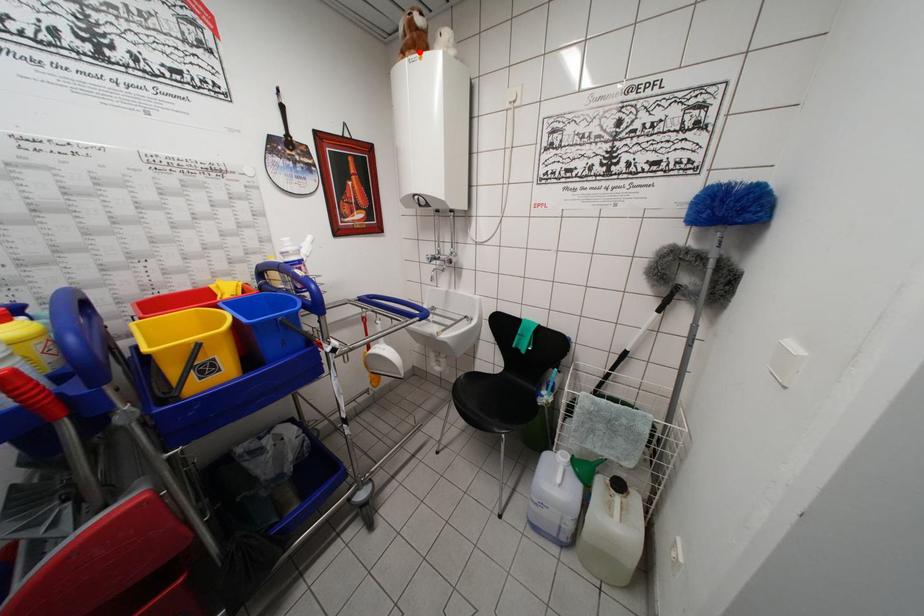
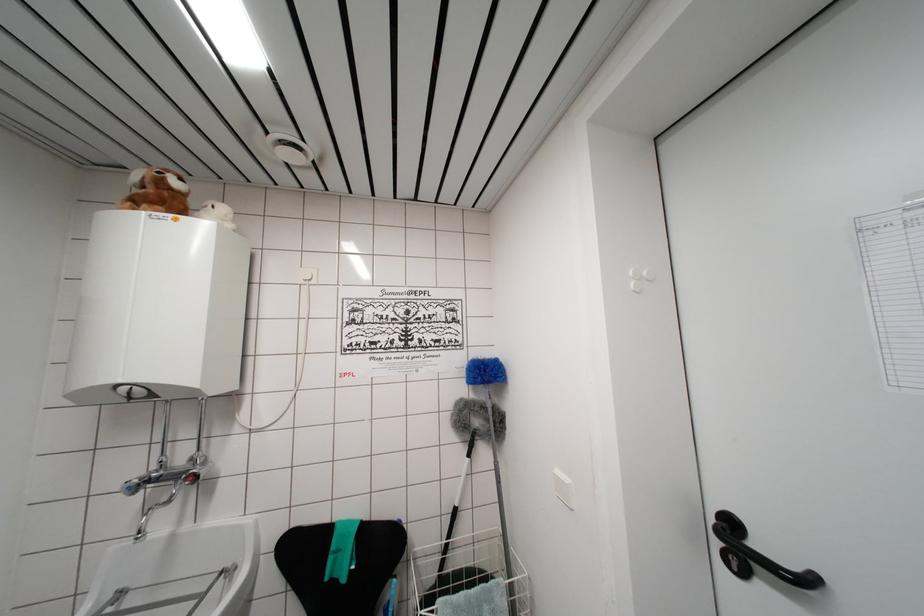
Find the pixel in the second image that matches the highlighted location in the first image.

(168, 209)